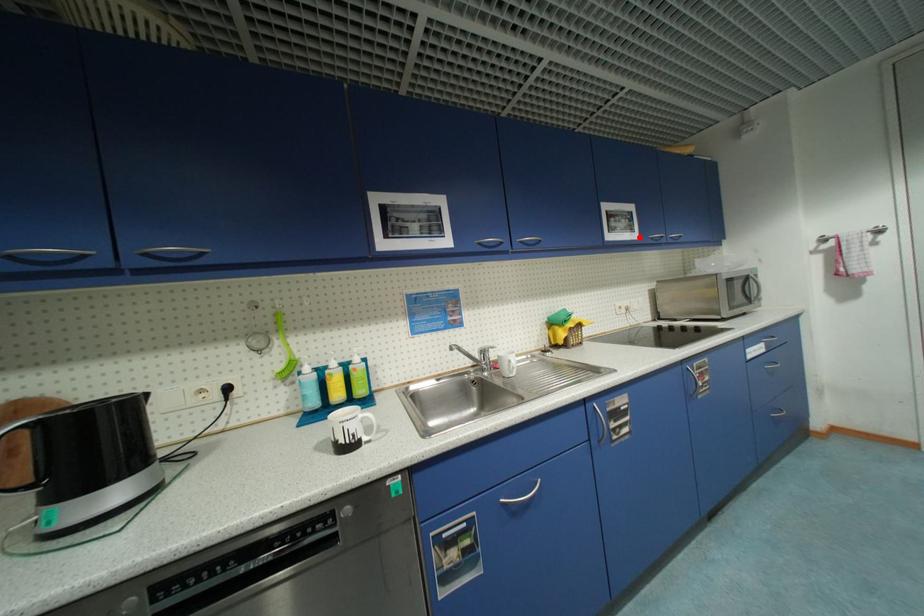
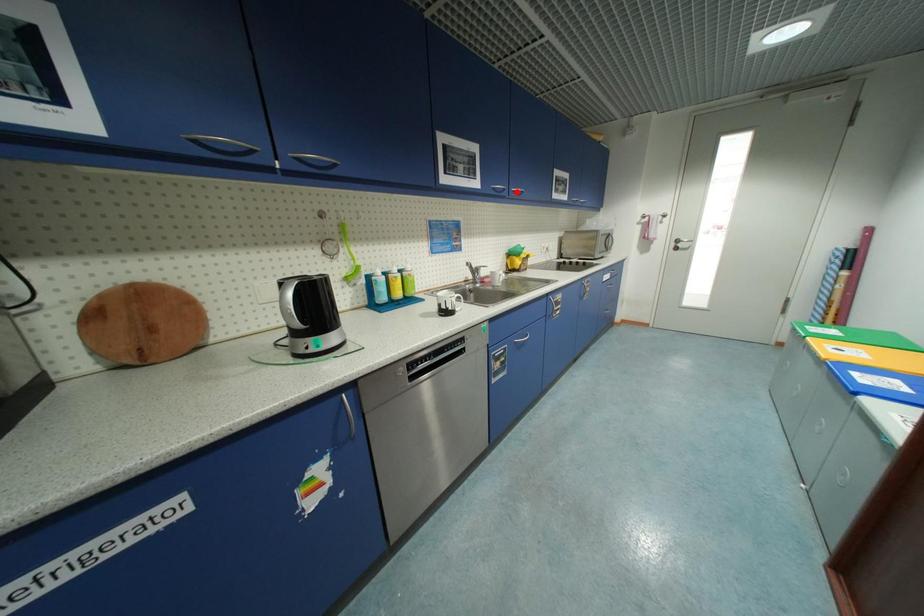
Consider the image. I am providing you with two images of the same scene from different viewpoints. A red point is marked on the first image and another point is marked on the second image. Is the red point in image1 aligned with the point shown in image2?

No